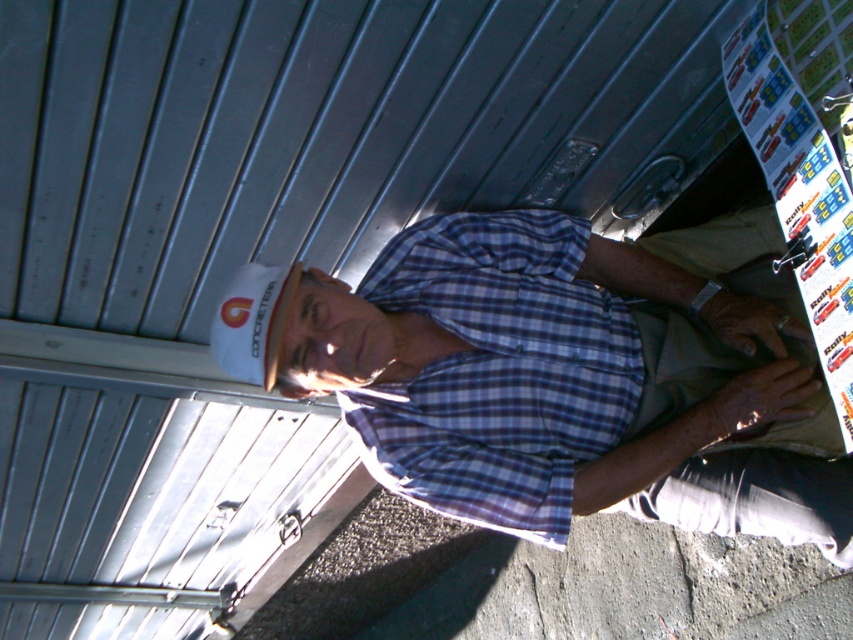
You are an observer standing in front of the man. Which item is shorter in height between the blue checkered shirt at center and the khaki fabric at lower right?

The blue checkered shirt at center has a lesser height compared to the khaki fabric at lower right, so the blue checkered shirt at center is shorter in height.

In the scene shown: You are a construction worker standing at the point closer to you between point [439,304] and point [692,433]. You need to move to the point further away. Which coordinate should you walk towards?

You should walk towards point [692,433] because point [439,304] is closer to you, and point [692,433] is further away.

Based on the scene description, where is the white hard hat at upper left located in the image?

The white hard hat at upper left is located at the 2D coordinates point (558,376) in the image.